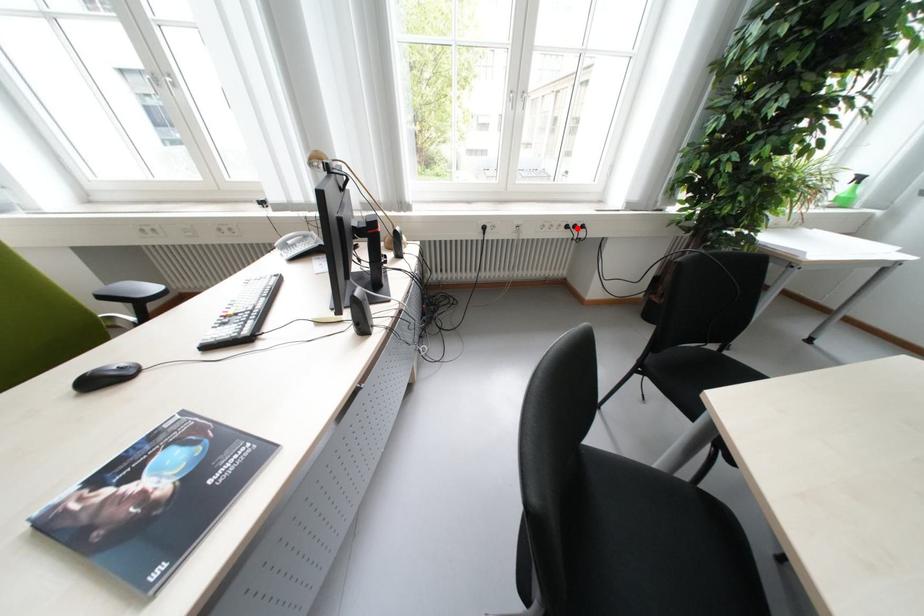
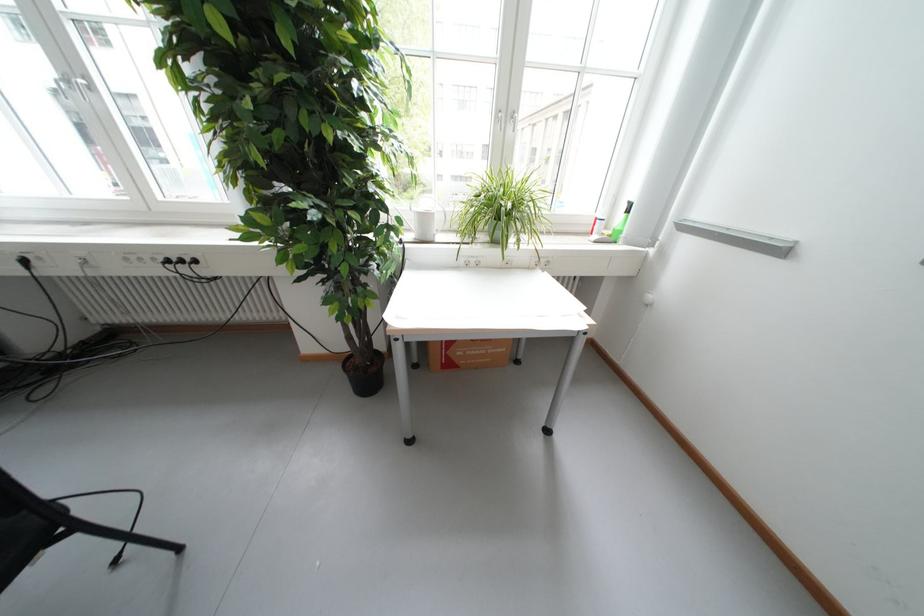
Question: I am providing you with two images of the same scene from different viewpoints. A red point is shown in image1. For the corresponding object point in image2, is it positioned nearer or farther from the camera?

Choices:
 (A) Nearer
 (B) Farther

Answer: (B)